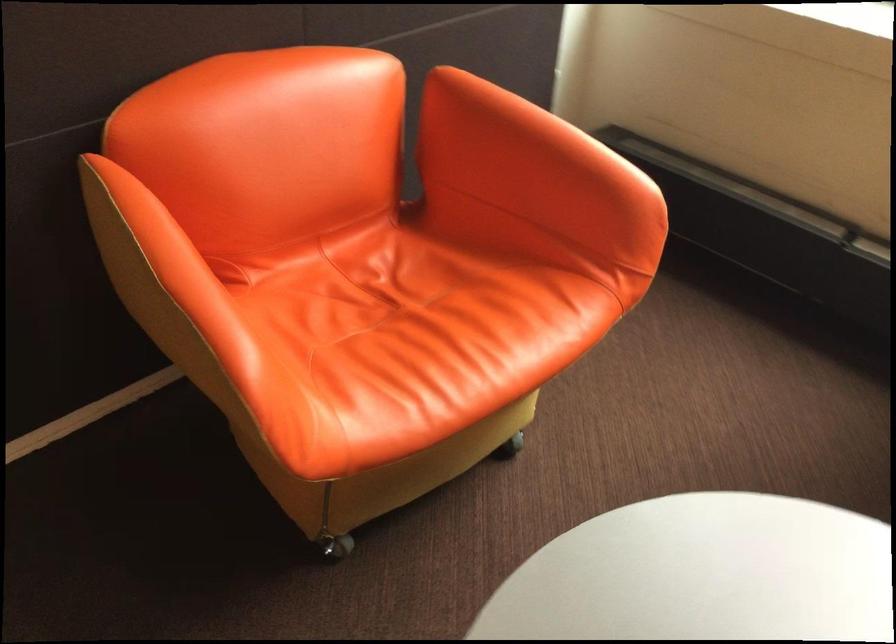
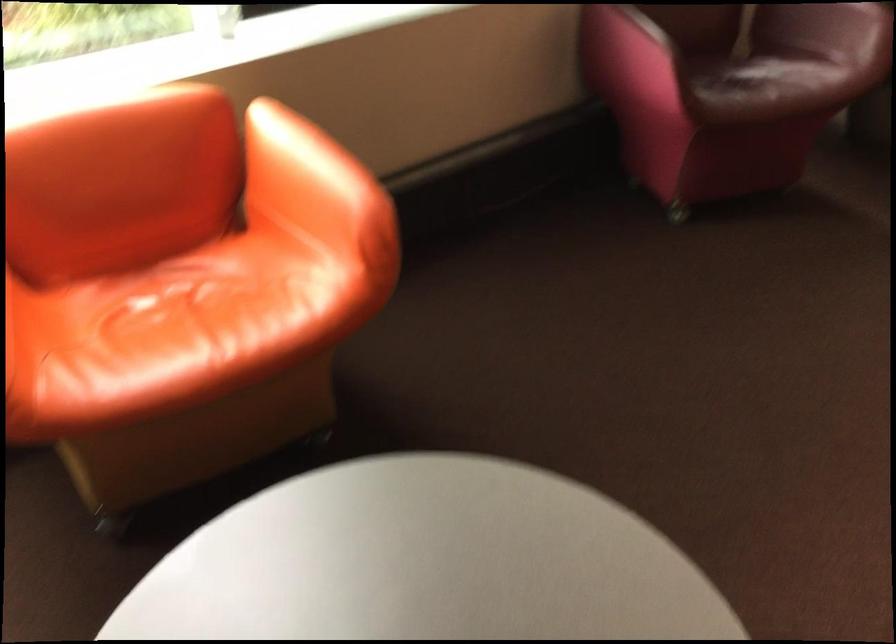
The images are taken continuously from a first-person perspective. In which direction is your viewpoint rotating?

The rotation direction of the camera is right-down.